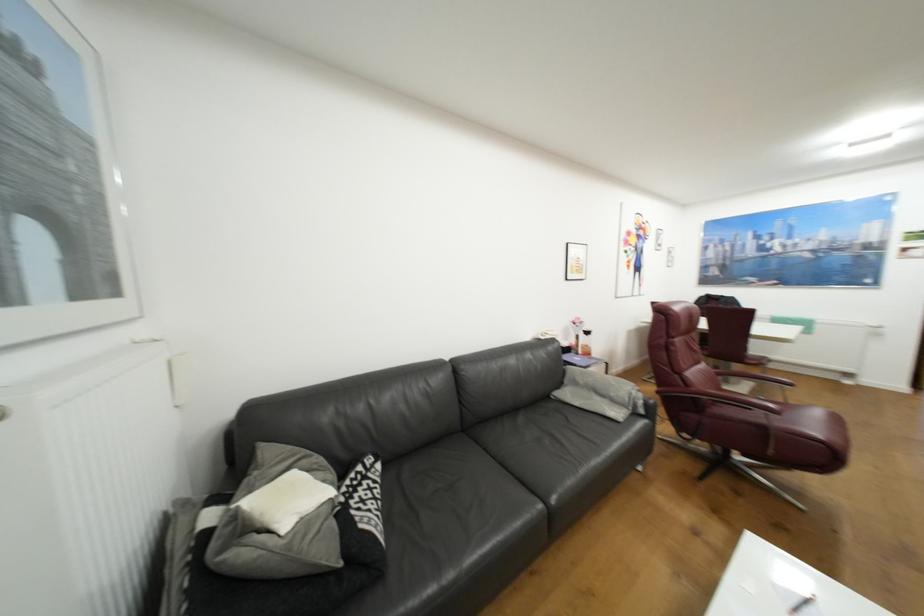
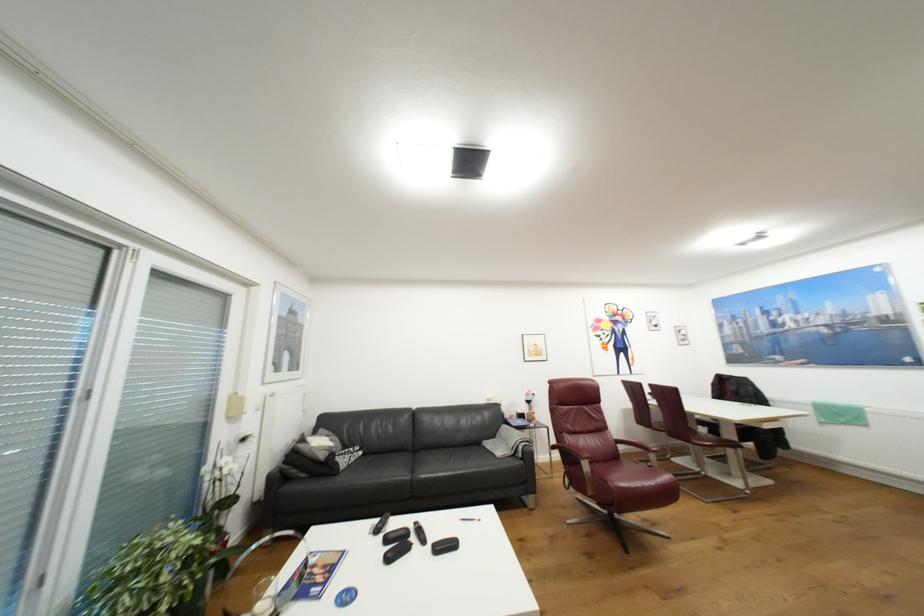
Locate, in the second image, the point that corresponds to (383,491) in the first image.

(359, 459)